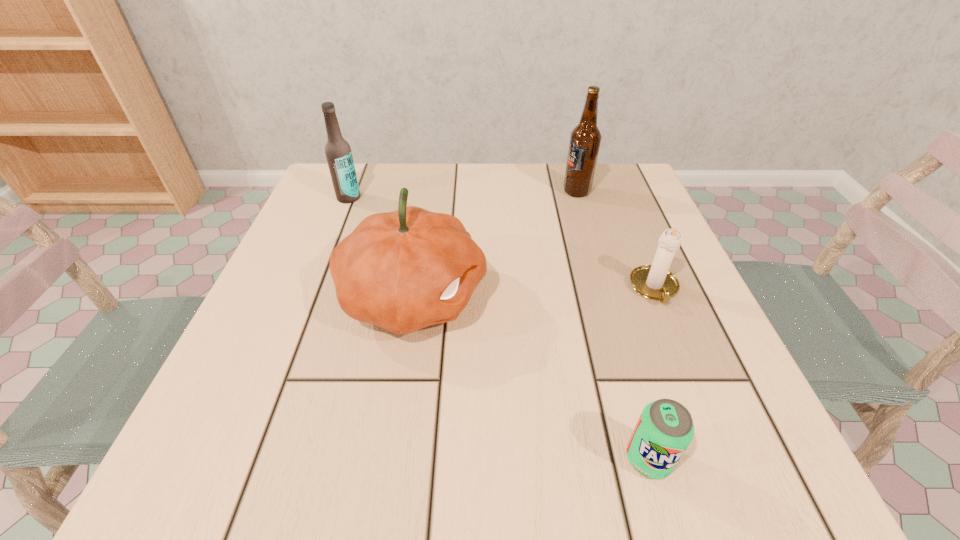
In order to click on blank region between the leftmost object and the rightmost object in this screenshot , I will do `click(501, 243)`.

At what (x,y) coordinates should I click in order to perform the action: click on blank region between the second object from left to right and the candle holder. Please return your answer as a coordinate pair (x, y). Looking at the image, I should click on (534, 293).

This screenshot has height=540, width=960. Find the location of `vacant region between the left beer bottle and the second shortest object`. vacant region between the left beer bottle and the second shortest object is located at coordinates (501, 243).

I want to click on free space between the pop soda and the left beer bottle, so click(x=498, y=328).

Locate an element on the screen. The image size is (960, 540). free space that is in between the right beer bottle and the fourth tallest object is located at coordinates (615, 240).

Identify which object is located as the second nearest to the right beer bottle. Please provide its 2D coordinates. Your answer should be formatted as a tuple, i.e. [(x, y)], where the tuple contains the x and y coordinates of a point satisfying the conditions above.

[(404, 270)]

The width and height of the screenshot is (960, 540). What are the coordinates of `the third closest object to the rightmost object` in the screenshot? It's located at (404, 270).

The width and height of the screenshot is (960, 540). Identify the location of free spot that satisfies the following two spatial constraints: 1. on the handle side of the rightmost object; 2. on the front face of the pumpkin. (658, 297).

Identify the location of free point that satisfies the following two spatial constraints: 1. on the label of the right beer bottle; 2. on the front-facing side of the nearest object. The width and height of the screenshot is (960, 540). (656, 458).

The image size is (960, 540). Find the location of `vacant space that satisfies the following two spatial constraints: 1. on the label of the right beer bottle; 2. on the label of the left beer bottle`. vacant space that satisfies the following two spatial constraints: 1. on the label of the right beer bottle; 2. on the label of the left beer bottle is located at coordinates (578, 198).